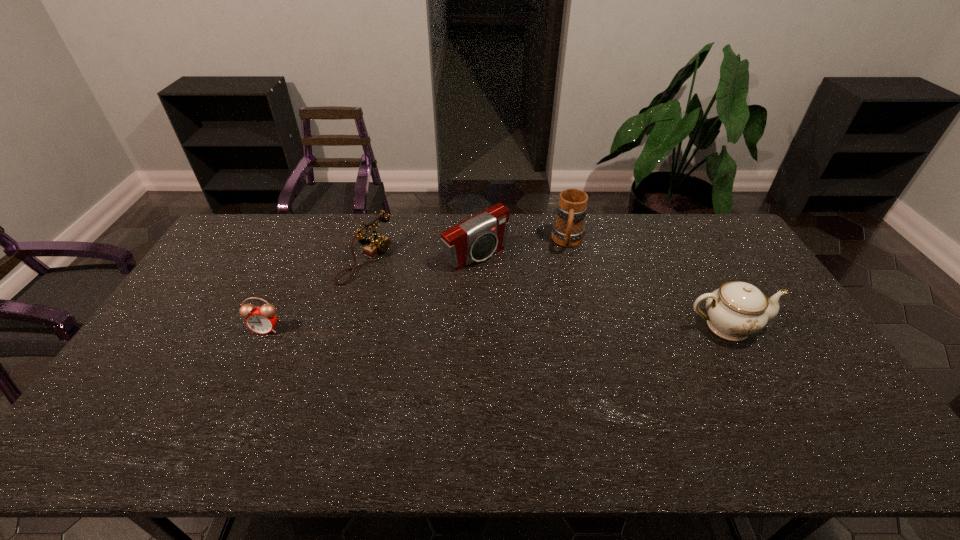
In the image, there is a desktop. Where is `free region at the far edge`? free region at the far edge is located at coordinates (637, 239).

Where is `free space at the near edge of the desktop`? The width and height of the screenshot is (960, 540). free space at the near edge of the desktop is located at coordinates (549, 386).

Where is `free region at the far right corner of the desktop`? Image resolution: width=960 pixels, height=540 pixels. free region at the far right corner of the desktop is located at coordinates (684, 220).

Where is `empty space that is in between the leftmost object and the rightmost object`? This screenshot has width=960, height=540. empty space that is in between the leftmost object and the rightmost object is located at coordinates (496, 328).

Image resolution: width=960 pixels, height=540 pixels. In order to click on free spot between the third object from left to right and the mug in this screenshot , I will do `click(522, 249)`.

The height and width of the screenshot is (540, 960). In order to click on vacant area that lies between the chinaware and the alarm clock in this screenshot , I will do `click(496, 328)`.

Where is `empty space that is in between the chinaware and the mug`? The height and width of the screenshot is (540, 960). empty space that is in between the chinaware and the mug is located at coordinates (647, 284).

Locate an element on the screen. vacant area that lies between the third object from right to left and the alarm clock is located at coordinates (372, 292).

Locate an element on the screen. The height and width of the screenshot is (540, 960). vacant region between the chinaware and the telephone is located at coordinates click(545, 293).

Image resolution: width=960 pixels, height=540 pixels. I want to click on vacant region between the fourth object from left to right and the alarm clock, so click(x=418, y=286).